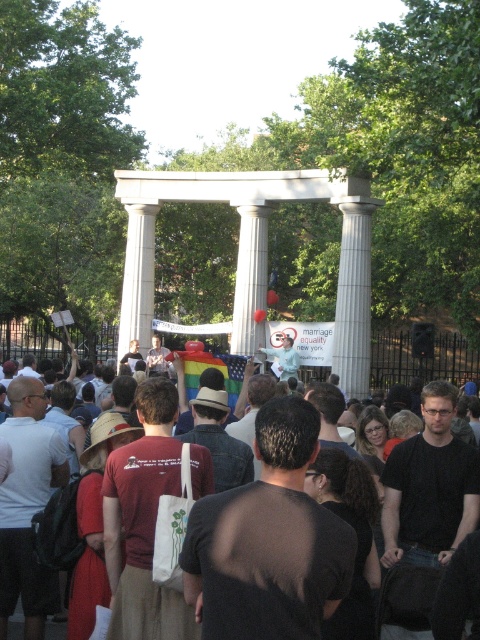
Locate an element on the screen. Image resolution: width=480 pixels, height=640 pixels. dark brown cotton t-shirt at center is located at coordinates (398, 356).

Is dark brown cotton t-shirt at center taller than white marble pillar at center?

No.

Where is `dark brown cotton t-shirt at center`? dark brown cotton t-shirt at center is located at coordinates (398, 356).

Which of these two, white marble column at center or white marble pillar at center, stands shorter?

white marble pillar at center is shorter.

Does white marble column at center have a lesser width compared to white marble pillar at center?

No, white marble column at center is not thinner than white marble pillar at center.

What do you see at coordinates (253, 252) in the screenshot? This screenshot has height=640, width=480. I see `white marble column at center` at bounding box center [253, 252].

I want to click on white marble column at center, so click(x=253, y=252).

Is white marble column at center positioned in front of dark brown cotton t-shirt at center?

No, white marble column at center is further to the viewer.

Between white marble column at center and dark brown cotton t-shirt at center, which one is positioned higher?

Positioned higher is white marble column at center.

Is point (257, 250) more distant than point (70, 436)?

Yes, point (257, 250) is behind point (70, 436).

The width and height of the screenshot is (480, 640). Find the location of `white marble column at center`. white marble column at center is located at coordinates (253, 252).